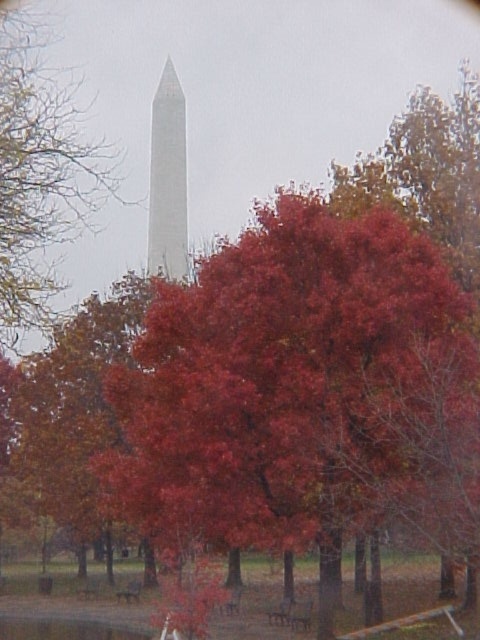
Can you confirm if shiny red leaves at center is bigger than white marble tower at center?

No, shiny red leaves at center is not bigger than white marble tower at center.

Can you confirm if shiny red leaves at center is positioned above white marble tower at center?

Incorrect, shiny red leaves at center is not positioned above white marble tower at center.

Who is more forward, (x=206, y=396) or (x=151, y=128)?

Point (x=206, y=396)

Image resolution: width=480 pixels, height=640 pixels. Identify the location of shiny red leaves at center. (303, 392).

Can you confirm if shiny red leaves at center is positioned below smooth red tree at upper center?

Indeed, shiny red leaves at center is positioned under smooth red tree at upper center.

Does shiny red leaves at center have a larger size compared to smooth red tree at upper center?

Incorrect, shiny red leaves at center is not larger than smooth red tree at upper center.

Locate an element on the screen. shiny red leaves at center is located at coordinates (303, 392).

At what (x,y) coordinates should I click in order to perform the action: click on shiny red leaves at center. Please return your answer as a coordinate pair (x, y). Looking at the image, I should click on (303, 392).

Does smooth red tree at upper center have a lesser width compared to white marble tower at center?

Incorrect, smooth red tree at upper center's width is not less than white marble tower at center's.

The height and width of the screenshot is (640, 480). What do you see at coordinates (39, 177) in the screenshot? I see `smooth red tree at upper center` at bounding box center [39, 177].

The image size is (480, 640). Find the location of `smooth red tree at upper center`. smooth red tree at upper center is located at coordinates (39, 177).